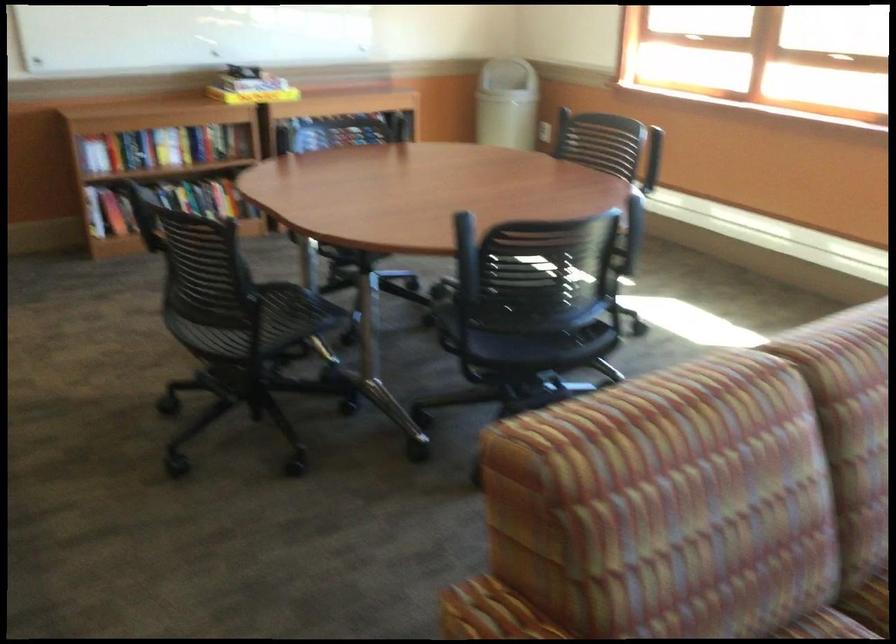
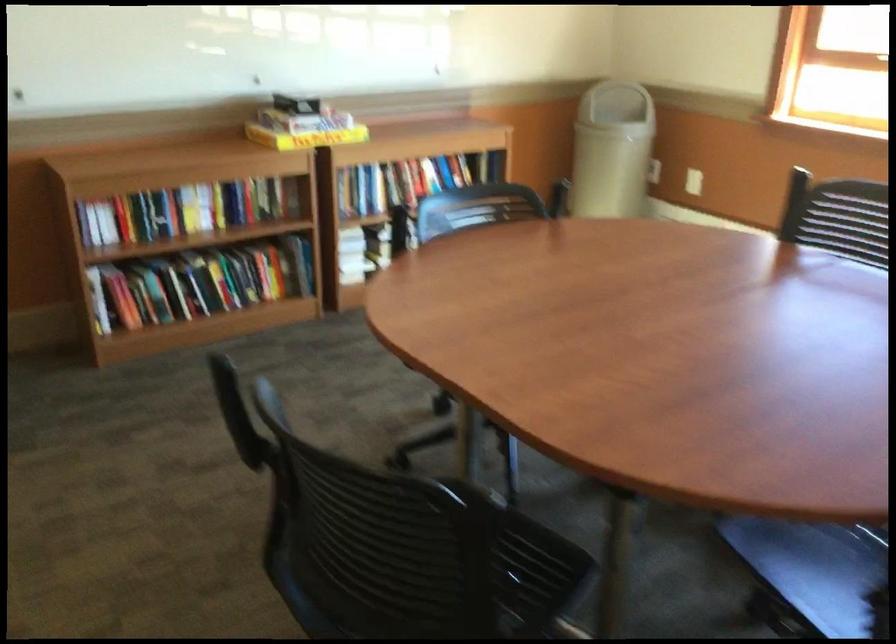
Find the pixel in the second image that matches [495,107] in the first image.

(612, 149)